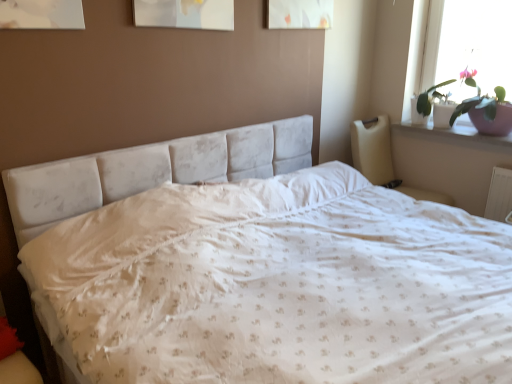
Question: Can you confirm if white velvety bed at center is shorter than white glossy window sill at upper right?

Choices:
 (A) yes
 (B) no

Answer: (B)

Question: Is white velvety bed at center to the left of white glossy window sill at upper right from the viewer's perspective?

Choices:
 (A) no
 (B) yes

Answer: (B)

Question: From a real-world perspective, is white velvety bed at center physically above white glossy window sill at upper right?

Choices:
 (A) yes
 (B) no

Answer: (B)

Question: Can you confirm if white velvety bed at center is wider than white glossy window sill at upper right?

Choices:
 (A) no
 (B) yes

Answer: (B)

Question: Could you tell me if white velvety bed at center is turned towards white glossy window sill at upper right?

Choices:
 (A) yes
 (B) no

Answer: (B)

Question: From a real-world perspective, is beige fabric armchair at right positioned above or below pink ceramic pot at upper right?

Choices:
 (A) above
 (B) below

Answer: (B)

Question: Considering the positions of point (390, 180) and point (509, 119), is point (390, 180) closer or farther from the camera than point (509, 119)?

Choices:
 (A) farther
 (B) closer

Answer: (A)

Question: Looking at the image, does beige fabric armchair at right seem bigger or smaller compared to pink ceramic pot at upper right?

Choices:
 (A) small
 (B) big

Answer: (B)

Question: Considering the relative positions of beige fabric armchair at right and pink ceramic pot at upper right in the image provided, is beige fabric armchair at right to the left or to the right of pink ceramic pot at upper right?

Choices:
 (A) left
 (B) right

Answer: (A)

Question: From their relative heights in the image, would you say pink ceramic pot at upper right is taller or shorter than white velvety bed at center?

Choices:
 (A) short
 (B) tall

Answer: (A)

Question: Would you say pink ceramic pot at upper right is inside or outside white velvety bed at center?

Choices:
 (A) outside
 (B) inside

Answer: (A)

Question: In terms of width, does pink ceramic pot at upper right look wider or thinner when compared to white velvety bed at center?

Choices:
 (A) thin
 (B) wide

Answer: (A)

Question: Considering their positions, is pink ceramic pot at upper right located in front of or behind white velvety bed at center?

Choices:
 (A) behind
 (B) front

Answer: (A)

Question: Based on their positions, is beige fabric armchair at right located to the left or right of white velvety bed at center?

Choices:
 (A) right
 (B) left

Answer: (A)

Question: Which is correct: beige fabric armchair at right is inside white velvety bed at center, or outside of it?

Choices:
 (A) inside
 (B) outside

Answer: (B)